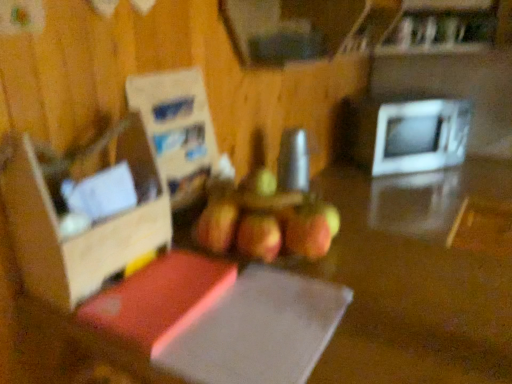
Question: Is ripe red apple at center wider or thinner than cardboard box at left?

Choices:
 (A) thin
 (B) wide

Answer: (B)

Question: Is ripe red apple at center in front of or behind cardboard box at left in the image?

Choices:
 (A) behind
 (B) front

Answer: (A)

Question: Estimate the real-world distances between objects in this image. Which object is closer to the cardboard box at left?

Choices:
 (A) white glossy microwave at right
 (B) ripe red apple at center

Answer: (B)

Question: Which object is positioned farthest from the white glossy microwave at right?

Choices:
 (A) cardboard box at left
 (B) ripe red apple at center

Answer: (A)